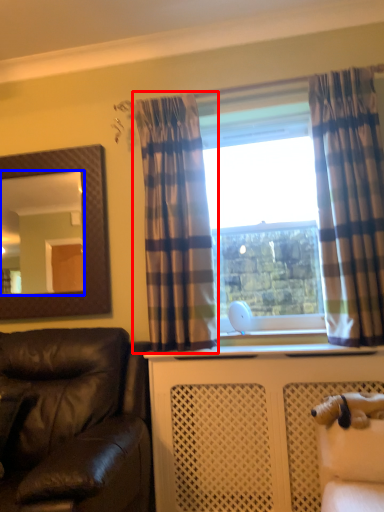
Question: Which of the following is the closest to the observer, curtain (highlighted by a red box) or mirror (highlighted by a blue box)?

Choices:
 (A) curtain
 (B) mirror

Answer: (A)